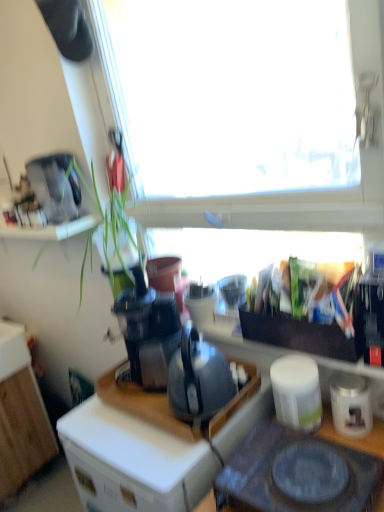
The height and width of the screenshot is (512, 384). What do you see at coordinates (231, 94) in the screenshot?
I see `transparent glass window at upper center` at bounding box center [231, 94].

Measure the distance between translucent plastic blender at center, which is counted as the second appliance, starting from the top, and camera.

translucent plastic blender at center, which is counted as the second appliance, starting from the top, and camera are 4.52 feet apart from each other.

Where is `translucent plastic blender at center, which is counted as the second appliance, starting from the top`? The height and width of the screenshot is (512, 384). translucent plastic blender at center, which is counted as the second appliance, starting from the top is located at coordinates (200, 303).

Where is `black glass gas stove at lower center`? The image size is (384, 512). black glass gas stove at lower center is located at coordinates pyautogui.click(x=298, y=473).

Identify the location of white plastic drawer at lower left. The width and height of the screenshot is (384, 512). (117, 486).

Is translucent plastic blender at center, which is counted as the 3th appliance, starting from the right, turned away from wooden cabinet at lower left?

No.

Is point (189, 293) closer to viewer compared to point (1, 420)?

Yes, it is.

From a real-world perspective, is translucent plastic blender at center, which is counted as the second appliance, starting from the top, positioned over wooden cabinet at lower left based on gravity?

Correct, in the physical world, translucent plastic blender at center, which is counted as the second appliance, starting from the top, is higher than wooden cabinet at lower left.

Considering the sizes of objects translucent plastic blender at center, which ranks as the second appliance in left-to-right order, and wooden cabinet at lower left in the image provided, who is wider, translucent plastic blender at center, which ranks as the second appliance in left-to-right order, or wooden cabinet at lower left?

wooden cabinet at lower left is wider.

From a real-world perspective, which is physically below, transparent glass window at upper center or black plastic coffee machine at center?

black plastic coffee machine at center is physically lower.

Consider the image. Looking at the image, does transparent glass window at upper center seem bigger or smaller compared to black plastic coffee machine at center?

transparent glass window at upper center is bigger than black plastic coffee machine at center.

Is transparent glass window at upper center next to black plastic coffee machine at center?

No, transparent glass window at upper center is not with black plastic coffee machine at center.

Considering the sizes of transparent glass window at upper center and black plastic coffee machine at center in the image, is transparent glass window at upper center wider or thinner than black plastic coffee machine at center?

transparent glass window at upper center is thinner than black plastic coffee machine at center.

Is wooden cabinet at lower left facing towards white glossy canister at right, placed as the first appliance when sorted from bottom to top?

Yes, wooden cabinet at lower left faces towards white glossy canister at right, placed as the first appliance when sorted from bottom to top.

Where is `cabinetry below the white glossy canister at right, which is counted as the 1th appliance, starting from the right (from a real-world perspective)`? The height and width of the screenshot is (512, 384). cabinetry below the white glossy canister at right, which is counted as the 1th appliance, starting from the right (from a real-world perspective) is located at coordinates (20, 414).

Is white glossy canister at right, acting as the 4th appliance starting from the top, surrounded by wooden cabinet at lower left?

Definitely not — white glossy canister at right, acting as the 4th appliance starting from the top, is not inside wooden cabinet at lower left.

Which object is positioned more to the left, wooden cabinet at lower left or white glossy canister at right, acting as the 4th appliance starting from the top?

wooden cabinet at lower left is more to the left.

Is black plastic coffee machine at center completely or partially inside satin silver coffee maker at upper left, placed as the fourth appliance when sorted from bottom to top?

Definitely not — black plastic coffee machine at center is not inside satin silver coffee maker at upper left, placed as the fourth appliance when sorted from bottom to top.

Is satin silver coffee maker at upper left, the 4th appliance viewed from the right, aimed at black plastic coffee machine at center?

No, satin silver coffee maker at upper left, the 4th appliance viewed from the right, is not aimed at black plastic coffee machine at center.

Which is less distant, (55, 215) or (175, 338)?

Point (55, 215).

Is satin silver coffee maker at upper left, the first appliance viewed from the top, touching black plastic coffee machine at center?

No.

Is transparent glass window at upper center inside the boundaries of matte black desk at center, or outside?

transparent glass window at upper center is spatially situated outside matte black desk at center.

What's the angular difference between transparent glass window at upper center and matte black desk at center's facing directions?

They differ by 0.58 degrees in their facing directions.

Is transparent glass window at upper center positioned far away from matte black desk at center?

That's not correct — transparent glass window at upper center is a little close to matte black desk at center.

Between transparent glass window at upper center and matte black desk at center, which one has smaller width?

transparent glass window at upper center is thinner.

Which of these two, transparent glass window at upper center or translucent plastic blender at center, which is counted as the 3th appliance, starting from the right, stands shorter?

translucent plastic blender at center, which is counted as the 3th appliance, starting from the right.

Between transparent glass window at upper center and translucent plastic blender at center, which is counted as the second appliance, starting from the top, which one is positioned in front?

transparent glass window at upper center is in front.

From the image's perspective, which object appears higher, transparent glass window at upper center or translucent plastic blender at center, placed as the 3th appliance when sorted from bottom to top?

transparent glass window at upper center, from the image's perspective.

Is transparent glass window at upper center positioned far away from translucent plastic blender at center, which ranks as the second appliance in left-to-right order?

No, there isn't a large distance between transparent glass window at upper center and translucent plastic blender at center, which ranks as the second appliance in left-to-right order.

Is black plastic coffee machine at center outside of wooden cabinet at lower left?

black plastic coffee machine at center is positioned outside wooden cabinet at lower left.

Does point (153, 319) lie in front of point (54, 455)?

Yes, it is in front of point (54, 455).

Is black plastic coffee machine at center to the left or to the right of wooden cabinet at lower left in the image?

black plastic coffee machine at center is to the right of wooden cabinet at lower left.

Considering the relative sizes of black plastic coffee machine at center and wooden cabinet at lower left in the image provided, is black plastic coffee machine at center wider than wooden cabinet at lower left?

Incorrect, the width of black plastic coffee machine at center does not surpass that of wooden cabinet at lower left.

You are a GUI agent. You are given a task and a screenshot of the screen. Output one action in this format:
    pyautogui.click(x=<x>, y=<y>)
    Task: Click on the appliance that is the 3rd one when counting upward from the wooden cabinet at lower left (from the image's perspective)
    This screenshot has width=384, height=512.
    Given the screenshot: What is the action you would take?
    coord(200,303)

You are a GUI agent. You are given a task and a screenshot of the screen. Output one action in this format:
    pyautogui.click(x=<x>, y=<y>)
    Task: Click on the coffee machine located behind the transparent glass window at upper center
    The height and width of the screenshot is (512, 384).
    Given the screenshot: What is the action you would take?
    pyautogui.click(x=148, y=331)

Based on their spatial positions, is translucent plastic blender at center, which ranks as the second appliance in left-to-right order, or black plastic coffee machine at center further from white plastic drawer at lower left?

Based on the image, translucent plastic blender at center, which ranks as the second appliance in left-to-right order, appears to be further to white plastic drawer at lower left.

When comparing their distances from black glass gas stove at lower center, does white plastic drawer at lower left or transparent glass window at upper center seem closer?

The object closer to black glass gas stove at lower center is white plastic drawer at lower left.

From the image, which object appears to be farther from white glossy canister at right, placed as the first appliance when sorted from bottom to top, white plastic drawer at lower left or white matte container at lower right, placed as the third appliance when sorted from left to right?

white plastic drawer at lower left lies further to white glossy canister at right, placed as the first appliance when sorted from bottom to top, than the other object.

From the image, which object appears to be farther from transparent glass window at upper center, translucent plastic blender at center, which ranks as the second appliance in left-to-right order, or white plastic drawer at lower left?

white plastic drawer at lower left.

Looking at the image, which one is located closer to satin silver coffee maker at upper left, placed as the fourth appliance when sorted from bottom to top, white matte container at lower right, the second appliance from the bottom, or white glossy canister at right, acting as the 4th appliance starting from the top?

white matte container at lower right, the second appliance from the bottom, is positioned closer to the anchor satin silver coffee maker at upper left, placed as the fourth appliance when sorted from bottom to top.

Based on their spatial positions, is black plastic coffee machine at center or transparent glass window at upper center further from white matte container at lower right, which is counted as the third appliance, starting from the top?

transparent glass window at upper center is positioned further to the anchor white matte container at lower right, which is counted as the third appliance, starting from the top.

Estimate the real-world distances between objects in this image. Which object is further from white matte container at lower right, the second appliance in the right-to-left sequence, white glossy canister at right, placed as the first appliance when sorted from bottom to top, or satin silver coffee maker at upper left, positioned as the first appliance in left-to-right order?

The object further to white matte container at lower right, the second appliance in the right-to-left sequence, is satin silver coffee maker at upper left, positioned as the first appliance in left-to-right order.

From the image, which object appears to be farther from white glossy canister at right, acting as the 4th appliance starting from the top, black glass gas stove at lower center or satin silver coffee maker at upper left, the 4th appliance viewed from the right?

Based on the image, satin silver coffee maker at upper left, the 4th appliance viewed from the right, appears to be further to white glossy canister at right, acting as the 4th appliance starting from the top.

You are a GUI agent. You are given a task and a screenshot of the screen. Output one action in this format:
    pyautogui.click(x=<x>, y=<y>)
    Task: Click on the gas stove between white plastic drawer at lower left and white matte container at lower right, the second appliance in the right-to-left sequence
    This screenshot has width=384, height=512.
    Given the screenshot: What is the action you would take?
    pyautogui.click(x=298, y=473)

Where is `coffee machine that lies between satin silver coffee maker at upper left, the 4th appliance viewed from the right, and wooden cabinet at lower left from top to bottom`? This screenshot has height=512, width=384. coffee machine that lies between satin silver coffee maker at upper left, the 4th appliance viewed from the right, and wooden cabinet at lower left from top to bottom is located at coordinates (148, 331).

The width and height of the screenshot is (384, 512). Identify the location of gas stove that lies between satin silver coffee maker at upper left, placed as the fourth appliance when sorted from bottom to top, and white plastic drawer at lower left from top to bottom. (298, 473).

Locate an element on the screen. coffee machine between satin silver coffee maker at upper left, the 4th appliance viewed from the right, and black glass gas stove at lower center, in the vertical direction is located at coordinates (148, 331).